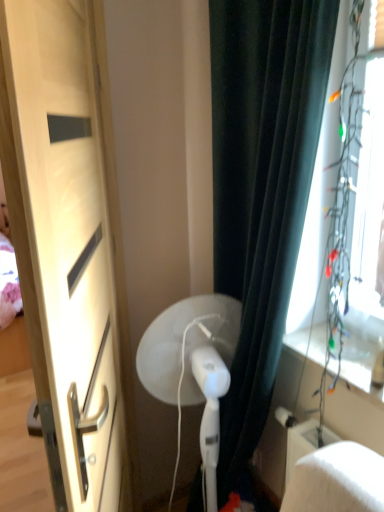
Question: From the image's perspective, is matte wood door at left located beneath transparent plastic window screen at right?

Choices:
 (A) yes
 (B) no

Answer: (A)

Question: Is matte wood door at left to the left of transparent plastic window screen at right from the viewer's perspective?

Choices:
 (A) no
 (B) yes

Answer: (B)

Question: Is matte wood door at left positioned in front of transparent plastic window screen at right?

Choices:
 (A) yes
 (B) no

Answer: (A)

Question: Is matte wood door at left positioned far away from transparent plastic window screen at right?

Choices:
 (A) no
 (B) yes

Answer: (A)

Question: Considering the relative sizes of matte wood door at left and transparent plastic window screen at right in the image provided, is matte wood door at left taller than transparent plastic window screen at right?

Choices:
 (A) yes
 (B) no

Answer: (A)

Question: Is matte wood door at left positioned with its back to transparent plastic window screen at right?

Choices:
 (A) yes
 (B) no

Answer: (A)

Question: Does white plastic fan at center have a greater height compared to matte wood door at left?

Choices:
 (A) no
 (B) yes

Answer: (A)

Question: Considering the relative positions of white plastic fan at center and matte wood door at left in the image provided, is white plastic fan at center to the left of matte wood door at left from the viewer's perspective?

Choices:
 (A) yes
 (B) no

Answer: (B)

Question: Is white plastic fan at center wider than matte wood door at left?

Choices:
 (A) yes
 (B) no

Answer: (A)

Question: From the image's perspective, is white plastic fan at center on top of matte wood door at left?

Choices:
 (A) yes
 (B) no

Answer: (B)

Question: From the image's perspective, does white plastic fan at center appear lower than matte wood door at left?

Choices:
 (A) no
 (B) yes

Answer: (B)

Question: Considering the relative positions of white plastic fan at center and matte wood door at left in the image provided, is white plastic fan at center to the right of matte wood door at left from the viewer's perspective?

Choices:
 (A) yes
 (B) no

Answer: (A)

Question: Is matte wood door at left beside white plastic fan at center?

Choices:
 (A) yes
 (B) no

Answer: (B)